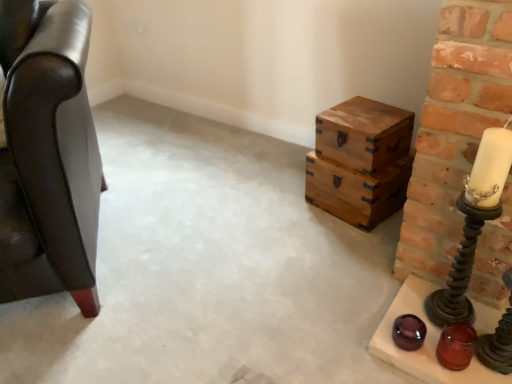
Question: Is shiny dark brown candle holder at right, acting as the 2th candle holder starting from the top, bigger or smaller than metallic spiral candlestick at right, marked as the 3th candle holder in a bottom-to-top arrangement?

Choices:
 (A) small
 (B) big

Answer: (A)

Question: Is point click(506, 269) positioned closer to the camera than point click(473, 263)?

Choices:
 (A) farther
 (B) closer

Answer: (B)

Question: Estimate the real-world distances between objects in this image. Which object is closer to the wooden crates at right?

Choices:
 (A) metallic spiral candlestick at right, marked as the first candle holder in a top-to-bottom arrangement
 (B) shiny dark brown candle holder at right, the second candle holder positioned from the bottom
 (C) leather armchair at left
 (D) translucent glass candle holder at lower right, which appears as the third candle holder when viewed from the top

Answer: (A)

Question: Which is farther from the shiny dark brown candle holder at right, acting as the 2th candle holder starting from the top?

Choices:
 (A) translucent glass candle holder at lower right, which appears as the first candle holder when ordered from the bottom
 (B) metallic spiral candlestick at right, marked as the 3th candle holder in a bottom-to-top arrangement
 (C) leather armchair at left
 (D) wooden crates at right

Answer: (C)